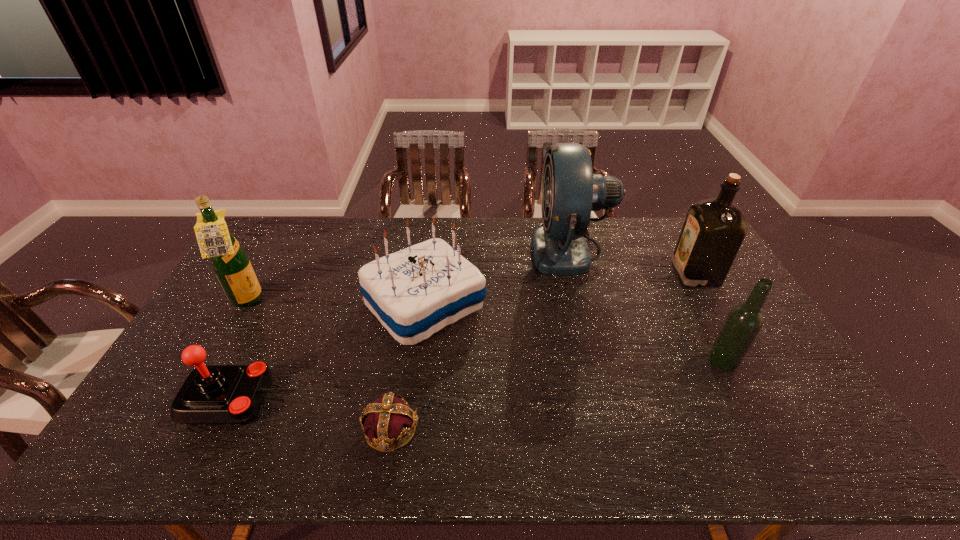
Find the location of a particular element. Image resolution: width=960 pixels, height=540 pixels. vacant region located 0.150m on the back of the nearest liquor is located at coordinates (698, 313).

Where is `vacant region located 0.140m on the left of the birthday cake`? vacant region located 0.140m on the left of the birthday cake is located at coordinates (320, 305).

At what (x,y) coordinates should I click in order to perform the action: click on free space located 0.270m on the base of the joystick. Please return your answer as a coordinate pair (x, y). The width and height of the screenshot is (960, 540). Looking at the image, I should click on (381, 399).

You are a GUI agent. You are given a task and a screenshot of the screen. Output one action in this format:
    pyautogui.click(x=<x>, y=<y>)
    Task: Click on the vacant position located 0.390m on the left of the crown
    The height and width of the screenshot is (540, 960).
    Given the screenshot: What is the action you would take?
    pyautogui.click(x=203, y=429)

Identify the location of object at the far edge. This screenshot has height=540, width=960. (570, 191).

The image size is (960, 540). I want to click on object positioned at the near edge, so click(x=389, y=419).

Locate an element on the screen. This screenshot has height=540, width=960. liquor that is at the left edge is located at coordinates (230, 262).

Find the location of a particular element. This screenshot has height=540, width=960. joystick that is at the left edge is located at coordinates (214, 394).

Where is `free spot at the far edge of the desktop`? free spot at the far edge of the desktop is located at coordinates (317, 217).

Where is `vacant space at the near edge of the desktop`? The image size is (960, 540). vacant space at the near edge of the desktop is located at coordinates (228, 434).